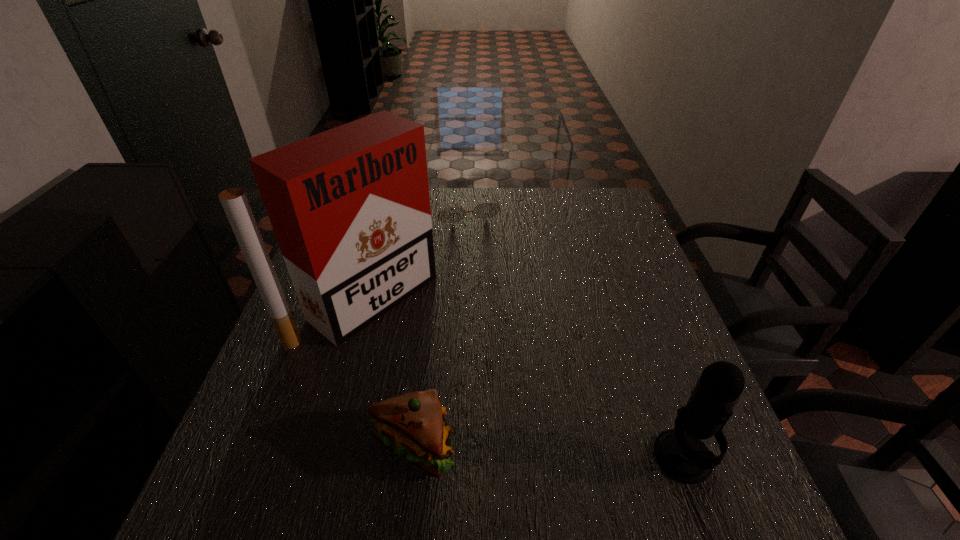
Find the location of `object that is at the near right corner`. object that is at the near right corner is located at coordinates (680, 453).

In order to click on vacant space at the far edge of the desktop in this screenshot , I will do `click(553, 206)`.

Image resolution: width=960 pixels, height=540 pixels. What are the coordinates of `vacant point at the left edge` in the screenshot? It's located at (276, 358).

This screenshot has width=960, height=540. Identify the location of blank space at the right edge of the desktop. (587, 246).

In the image, there is a desktop. At what (x,y) coordinates should I click in order to perform the action: click on vacant space at the far right corner. Please return your answer as a coordinate pair (x, y). The image size is (960, 540). Looking at the image, I should click on (588, 217).

In order to click on vacant region between the sandwich and the tallest object in this screenshot , I will do `click(391, 372)`.

The width and height of the screenshot is (960, 540). In order to click on free point between the tallest object and the microphone in this screenshot , I will do `click(525, 378)`.

Find the location of `vacant space that is in between the sandwich and the shortest object`. vacant space that is in between the sandwich and the shortest object is located at coordinates (439, 327).

This screenshot has height=540, width=960. I want to click on vacant space in between the second shortest object and the second farthest object, so click(x=391, y=372).

The width and height of the screenshot is (960, 540). Find the location of `free space between the sandwich and the sunglasses`. free space between the sandwich and the sunglasses is located at coordinates (439, 327).